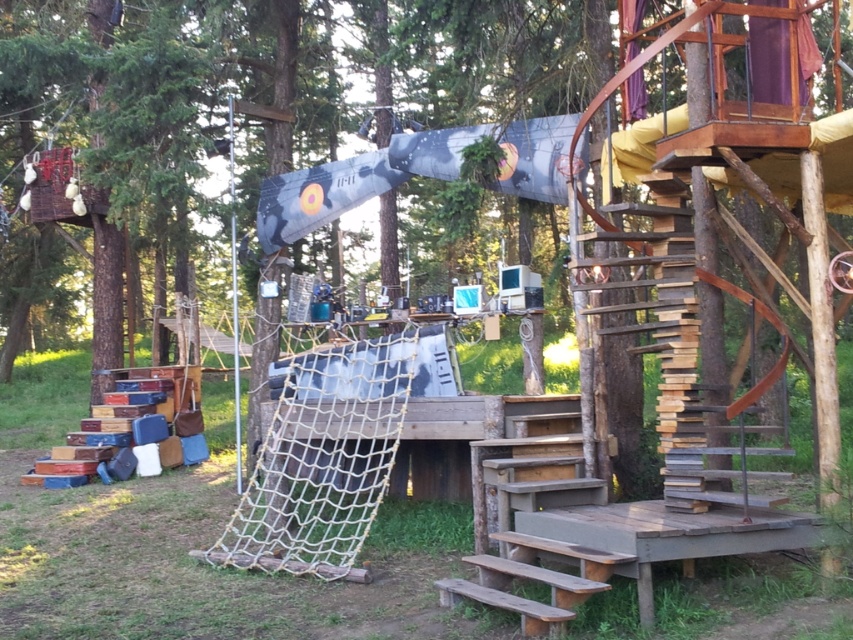
Question: Is white rope net at center above wooden stairs at center?

Choices:
 (A) no
 (B) yes

Answer: (B)

Question: Is wooden stairs at center thinner than wooden picnic table at center?

Choices:
 (A) no
 (B) yes

Answer: (B)

Question: Which point appears farthest from the camera in this image?

Choices:
 (A) (315, 504)
 (B) (624, 531)
 (C) (473, 556)

Answer: (A)

Question: Does white rope net at center appear on the right side of wooden picnic table at center?

Choices:
 (A) no
 (B) yes

Answer: (A)

Question: Among these objects, which one is farthest from the camera?

Choices:
 (A) wooden picnic table at center
 (B) white rope net at center
 (C) wooden stairs at center

Answer: (B)

Question: Which point is closer to the camera taking this photo?

Choices:
 (A) (363, 340)
 (B) (815, 516)
 (C) (575, 550)

Answer: (C)